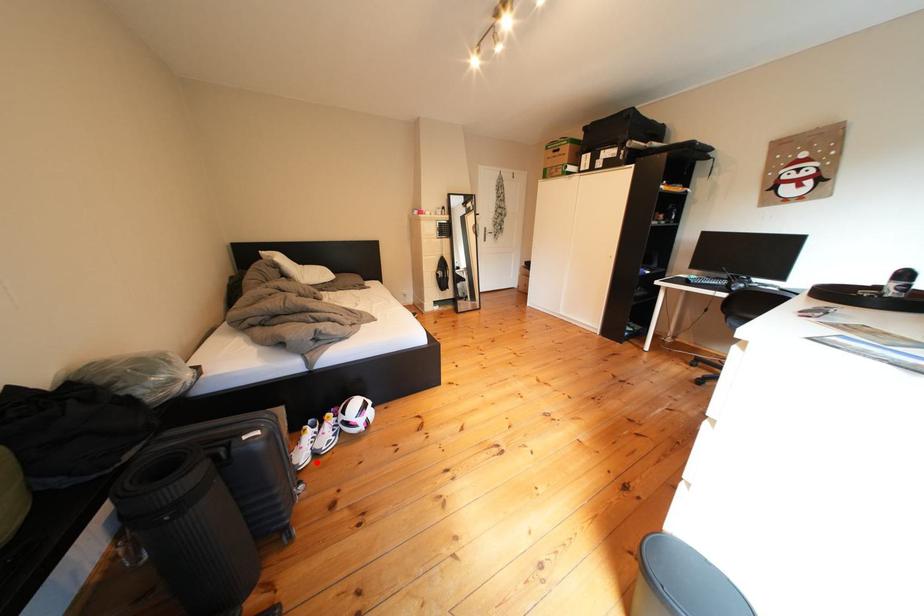
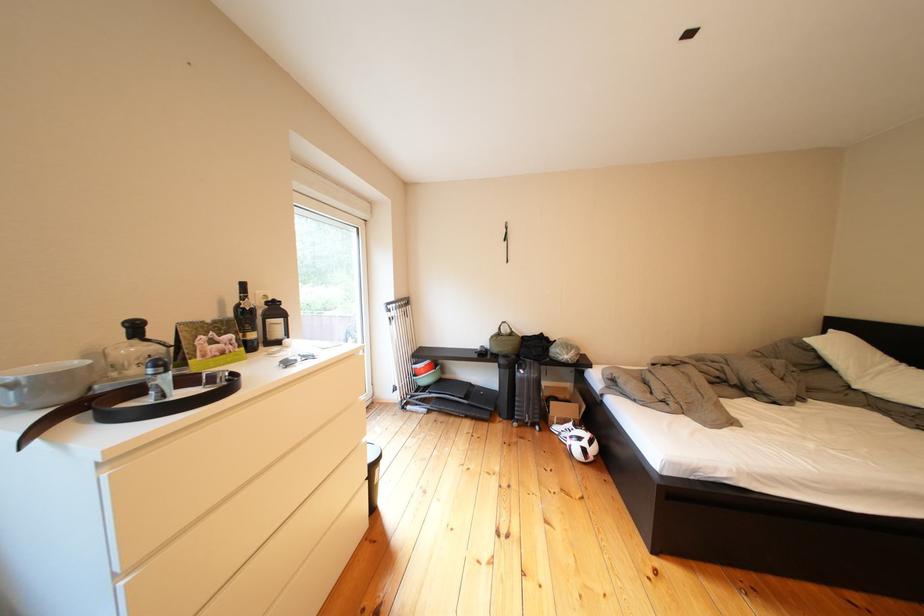
Find the pixel in the second image that matches the highlighted location in the first image.

(570, 432)